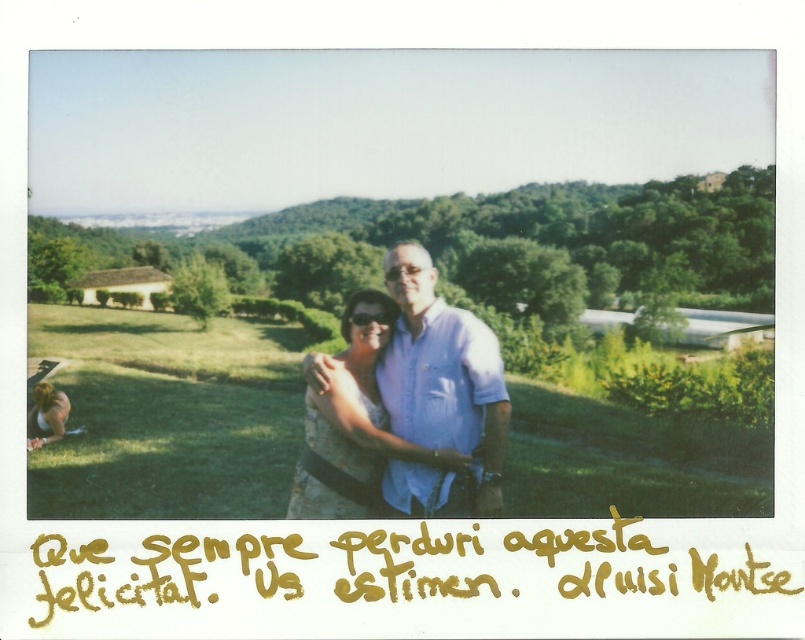
In the scene shown: You are standing at the origin point in the image. There are two points marked in the scene. The first point is at coordinate point[407,448] and the second is at point[32,397]. Which of these two points is closer to you?

Point[407,448] is in front of point[32,397], so it is closer to you.

You are a photographer planning to take a group photo of the matte blue shirt at center and the matte white dress at lower left. Since you want both subjects to appear equally sized in the photo, what adjustment should you make?

To make the matte blue shirt at center and the matte white dress at lower left appear the same size, you should move the matte blue shirt at center further away from the camera and bring the matte white dress at lower left closer, as the matte blue shirt at center is currently larger in size.

You are a photographer trying to capture the scene. You notice the matte blue shirt at center and the matte white dress at lower left. Which object should you focus on first if you want to capture the subject closer to the front of the image?

The matte white dress at lower left should be focused on first because it is located lower in the image, making it closer to the front compared to the matte blue shirt at center which is above it.